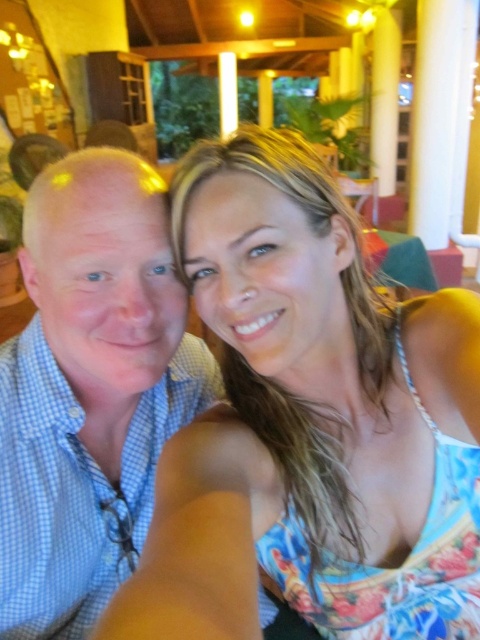
Question: Which of the following is the farthest from the observer?

Choices:
 (A) (265, 275)
 (B) (115, 538)

Answer: (B)

Question: Is floral fabric dress at center positioned in front of blue checkered shirt at left?

Choices:
 (A) yes
 (B) no

Answer: (A)

Question: Does floral fabric dress at center have a greater width compared to blue checkered shirt at left?

Choices:
 (A) no
 (B) yes

Answer: (B)

Question: Which object appears closest to the camera in this image?

Choices:
 (A) floral fabric dress at center
 (B) blue checkered shirt at left

Answer: (A)

Question: Which of the following is the closest to the observer?

Choices:
 (A) (224, 252)
 (B) (52, 372)

Answer: (A)

Question: Does floral fabric dress at center appear over blue checkered shirt at left?

Choices:
 (A) no
 (B) yes

Answer: (A)